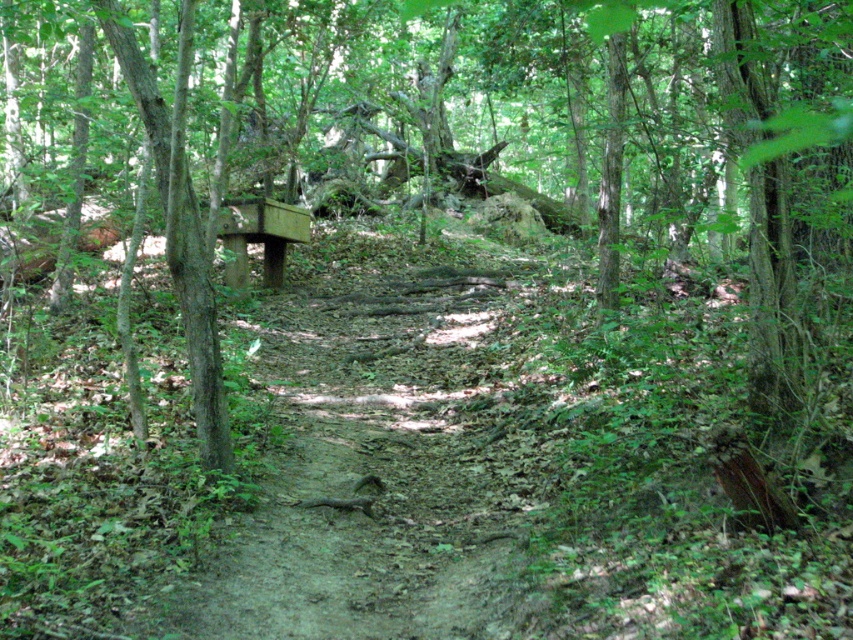
You are a hiker who wants to take a break on the wooden bench at center. However, you notice a smooth brown tree trunk at left nearby. Considering their sizes, which object is taller?

The smooth brown tree trunk at left is much taller than the wooden bench at center, so the tree trunk is taller.

In the scene shown: You are standing at the center of the dirt path in the forest. You want to sit on the wooden bench but notice the smooth brown tree trunk at left. Based on their positions, which object is closer to your current position?

The smooth brown tree trunk at left is located at point (178, 225), which is closer to your current position at the center of the dirt path compared to the wooden bench, so the smooth brown tree trunk at left is closer.

You are a hiker who wants to sit on the wooden bench at center. Is the smooth brown tree trunk at left blocking your path to the bench?

The smooth brown tree trunk at left is located below the wooden bench at center, so it is not blocking the path to the bench. You can approach the bench freely.